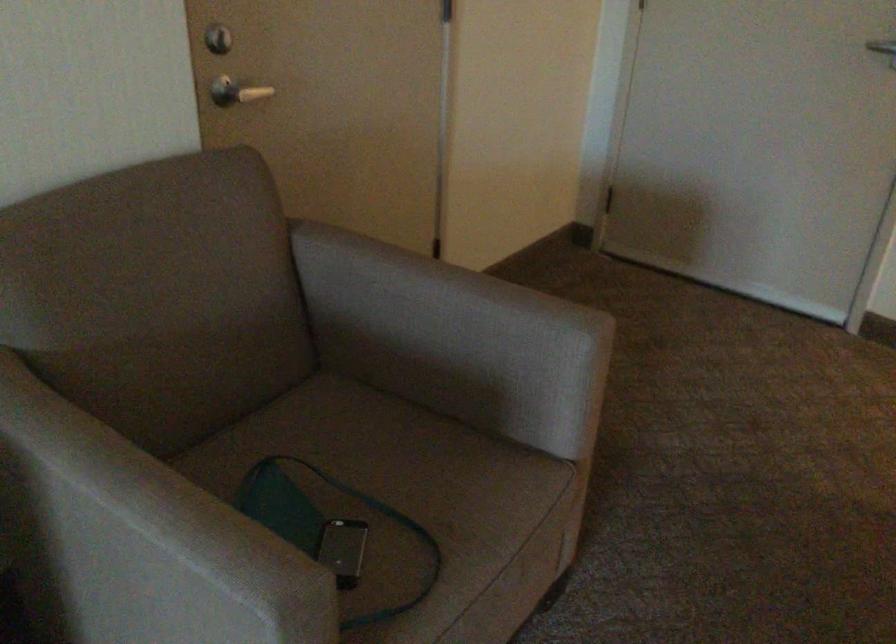
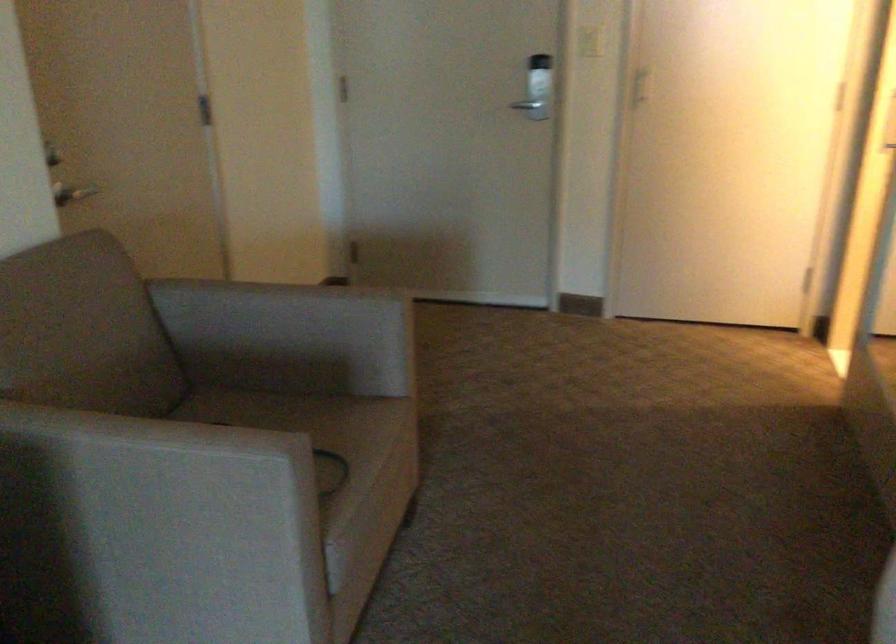
Question: Based on the continuous images, in which direction is the camera rotating? Reply with the corresponding letter.

Choices:
 (A) Left
 (B) Right
 (C) Up
 (D) Down

Answer: (B)